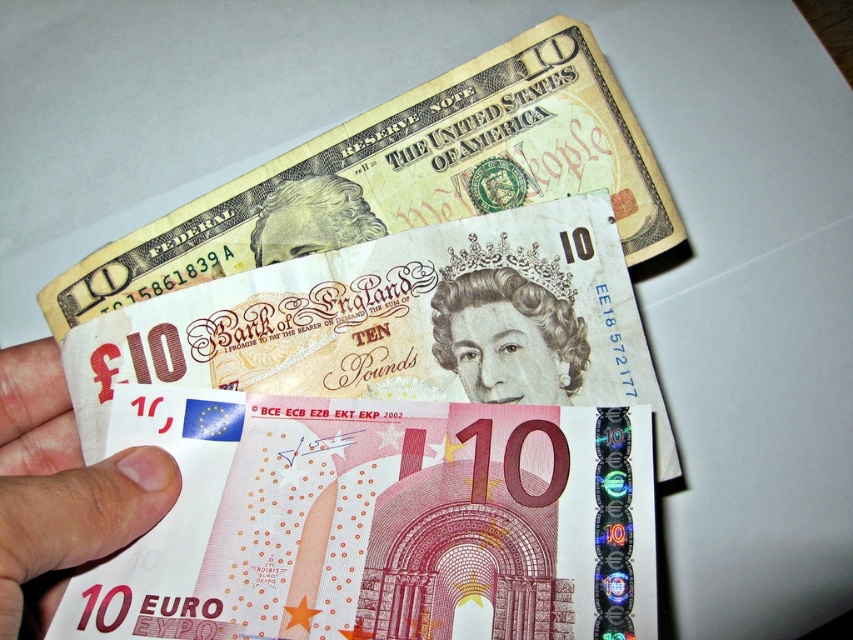
Question: In this image, where is smooth paper banknote at upper center located relative to matte yellow paper at upper center?

Choices:
 (A) left
 (B) right

Answer: (B)

Question: Which object is positioned closest to the smooth paper banknote at upper center?

Choices:
 (A) matte paper money at lower left
 (B) smooth paper portrait at center
 (C) matte yellow paper at upper center

Answer: (C)

Question: Can you confirm if matte paper money at lower left is smaller than smooth paper portrait at center?

Choices:
 (A) yes
 (B) no

Answer: (B)

Question: Is smooth paper banknote at upper center positioned at the back of matte paper money at lower left?

Choices:
 (A) yes
 (B) no

Answer: (A)

Question: Considering the real-world distances, which object is farthest from the smooth paper banknote at upper center?

Choices:
 (A) matte yellow paper at upper center
 (B) matte paper money at lower left
 (C) smooth paper portrait at center

Answer: (B)

Question: Which of the following is the closest to the observer?

Choices:
 (A) (309, 188)
 (B) (563, 316)
 (C) (26, 449)

Answer: (B)